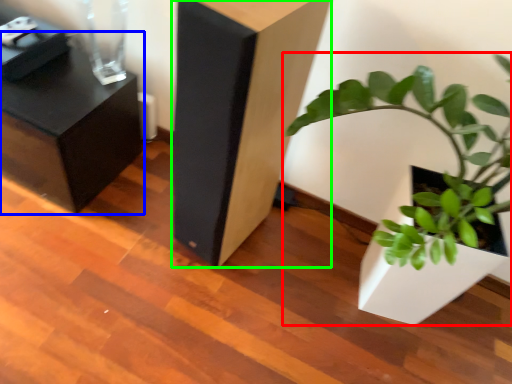
Question: Estimate the real-world distances between objects in this image. Which object is farther from houseplant (highlighted by a red box), furniture (highlighted by a blue box) or furniture (highlighted by a green box)?

Choices:
 (A) furniture
 (B) furniture

Answer: (A)